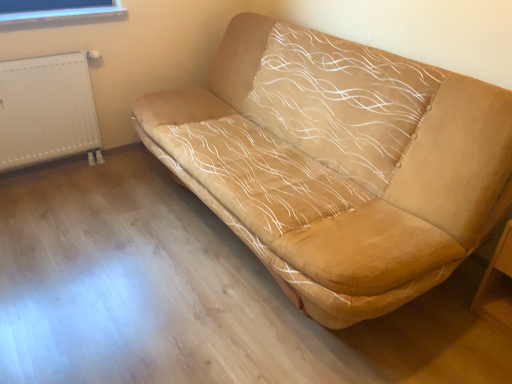
Question: Can you confirm if wooden table at lower right is thinner than white plastic radiator at left?

Choices:
 (A) no
 (B) yes

Answer: (A)

Question: Can you confirm if wooden table at lower right is bigger than white plastic radiator at left?

Choices:
 (A) no
 (B) yes

Answer: (A)

Question: Are wooden table at lower right and white plastic radiator at left making contact?

Choices:
 (A) yes
 (B) no

Answer: (B)

Question: Is wooden table at lower right located outside white plastic radiator at left?

Choices:
 (A) no
 (B) yes

Answer: (B)

Question: Considering the relative sizes of wooden table at lower right and white plastic radiator at left in the image provided, is wooden table at lower right smaller than white plastic radiator at left?

Choices:
 (A) yes
 (B) no

Answer: (A)

Question: Would you say white plastic radiator at left is inside or outside wooden table at lower right?

Choices:
 (A) outside
 (B) inside

Answer: (A)

Question: From a real-world perspective, relative to wooden table at lower right, is white plastic radiator at left vertically above or below?

Choices:
 (A) above
 (B) below

Answer: (A)

Question: Is white plastic radiator at left in front of or behind wooden table at lower right in the image?

Choices:
 (A) behind
 (B) front

Answer: (A)

Question: From their relative heights in the image, would you say white plastic radiator at left is taller or shorter than wooden table at lower right?

Choices:
 (A) short
 (B) tall

Answer: (B)

Question: Is suede-like beige sofa at center bigger or smaller than white plastic radiator at left?

Choices:
 (A) small
 (B) big

Answer: (B)

Question: In the image, is suede-like beige sofa at center positioned in front of or behind white plastic radiator at left?

Choices:
 (A) behind
 (B) front

Answer: (B)

Question: Looking at their shapes, would you say suede-like beige sofa at center is wider or thinner than white plastic radiator at left?

Choices:
 (A) thin
 (B) wide

Answer: (B)

Question: Would you say suede-like beige sofa at center is to the left or to the right of white plastic radiator at left in the picture?

Choices:
 (A) left
 (B) right

Answer: (B)

Question: Considering the positions of wooden table at lower right and white plastic radiator at left in the image, is wooden table at lower right taller or shorter than white plastic radiator at left?

Choices:
 (A) short
 (B) tall

Answer: (A)

Question: Considering their positions, is wooden table at lower right located in front of or behind white plastic radiator at left?

Choices:
 (A) front
 (B) behind

Answer: (A)